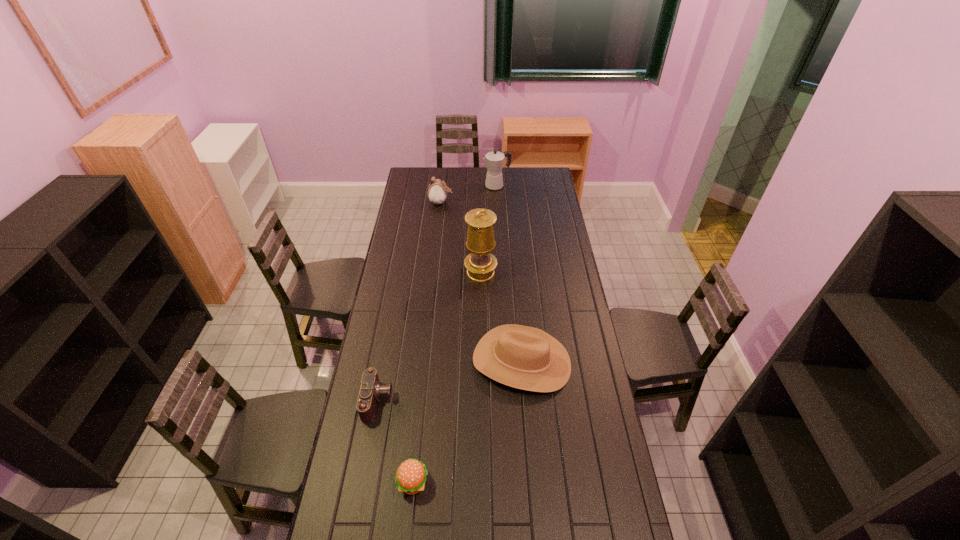
At what (x,y) coordinates should I click in order to perform the action: click on free location located 0.220m on the front-facing side of the pouch. Please return your answer as a coordinate pair (x, y). The width and height of the screenshot is (960, 540). Looking at the image, I should click on (491, 202).

I want to click on free space located 0.380m on the back of the cowboy hat, so click(515, 270).

Image resolution: width=960 pixels, height=540 pixels. I want to click on vacant space located 0.180m on the left of the hamburger, so click(343, 482).

Find the location of a particular element. The image size is (960, 540). vacant point located 0.240m on the front-facing side of the camera is located at coordinates (455, 401).

This screenshot has height=540, width=960. In order to click on object that is at the far edge in this screenshot , I will do `click(494, 160)`.

The height and width of the screenshot is (540, 960). I want to click on pouch at the left edge, so click(437, 193).

Image resolution: width=960 pixels, height=540 pixels. Identify the location of camera positioned at the left edge. (371, 389).

You are a GUI agent. You are given a task and a screenshot of the screen. Output one action in this format:
    pyautogui.click(x=<x>, y=<y>)
    Task: Click on the object at the right edge
    The width and height of the screenshot is (960, 540).
    Given the screenshot: What is the action you would take?
    pyautogui.click(x=523, y=357)

Find the location of a particular element. vacant space at the left edge of the desktop is located at coordinates click(380, 515).

Find the location of `vacant space at the right edge`. vacant space at the right edge is located at coordinates (561, 214).